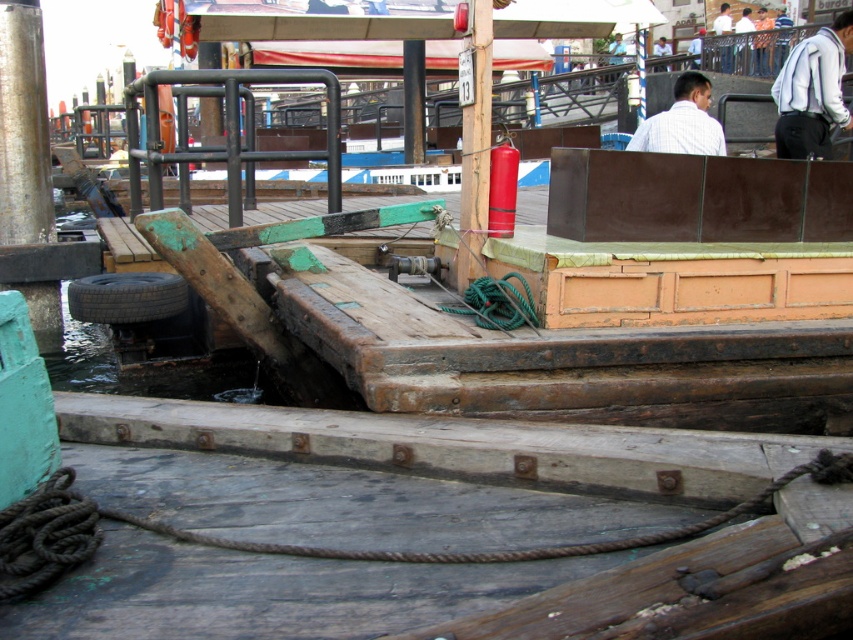
Question: Does white fabric shirt at upper right have a larger size compared to black rubber tire at lower left?

Choices:
 (A) yes
 (B) no

Answer: (A)

Question: Can you confirm if white fabric shirt at upper right is smaller than white shirt at upper center?

Choices:
 (A) yes
 (B) no

Answer: (B)

Question: Which object appears closest to the camera in this image?

Choices:
 (A) white fabric shirt at upper right
 (B) black rubber tire at lower left
 (C) white shirt at upper center

Answer: (C)

Question: Which is nearer to the white shirt at upper center?

Choices:
 (A) white fabric shirt at upper right
 (B) black rubber tire at lower left

Answer: (A)

Question: Estimate the real-world distances between objects in this image. Which object is farther from the black rubber tire at lower left?

Choices:
 (A) white shirt at upper center
 (B) white fabric shirt at upper right

Answer: (B)

Question: Does white fabric shirt at upper right appear on the left side of white shirt at upper center?

Choices:
 (A) no
 (B) yes

Answer: (A)